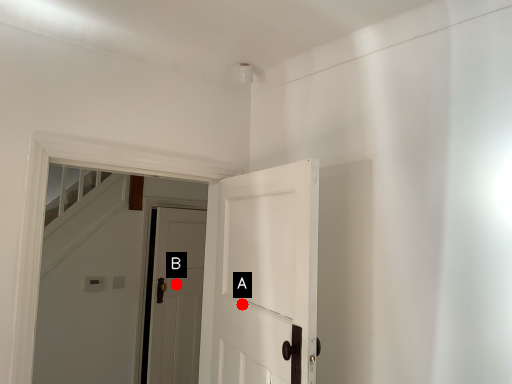
Question: Two points are circled on the image, labeled by A and B beside each circle. Which point appears farthest from the camera in this image?

Choices:
 (A) A is further
 (B) B is further

Answer: (B)